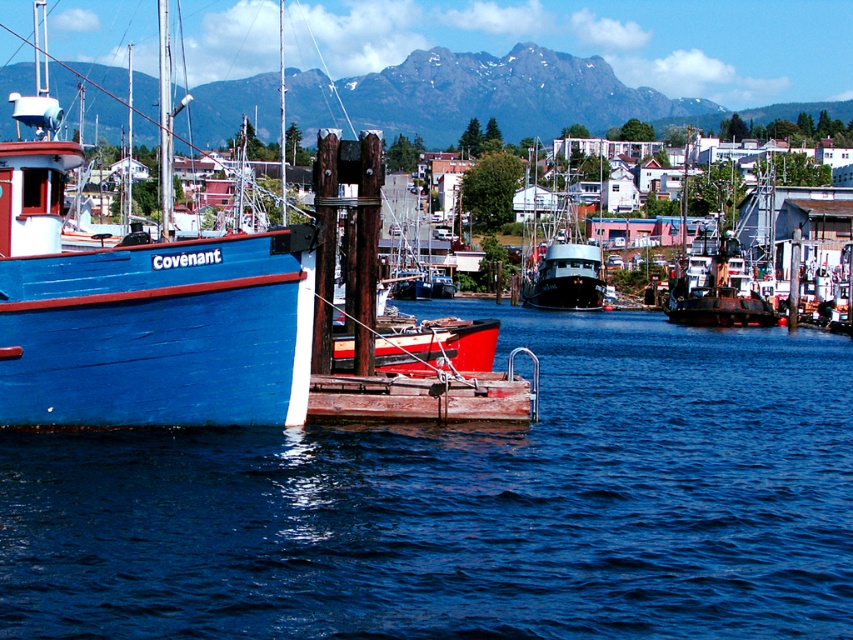
Question: Which of the following is the farthest from the observer?

Choices:
 (A) (119, 493)
 (B) (492, 403)
 (C) (3, 244)
 (D) (556, 264)

Answer: (D)

Question: Does matte blue wooden boat at left appear on the left side of black matte boat at center?

Choices:
 (A) yes
 (B) no

Answer: (A)

Question: Which object is positioned farthest from the black matte boat at center?

Choices:
 (A) matte blue wooden boat at left
 (B) blue water at left

Answer: (A)

Question: Is matte blue wooden boat at left wider than black matte boat at center?

Choices:
 (A) yes
 (B) no

Answer: (B)

Question: Considering the real-world distances, which object is farthest from the matte blue wooden boat at left?

Choices:
 (A) blue water at left
 (B) black matte boat at center
 (C) rusty wood dock at center

Answer: (B)

Question: Does matte blue wooden boat at left lie behind rusty wood dock at center?

Choices:
 (A) no
 (B) yes

Answer: (A)